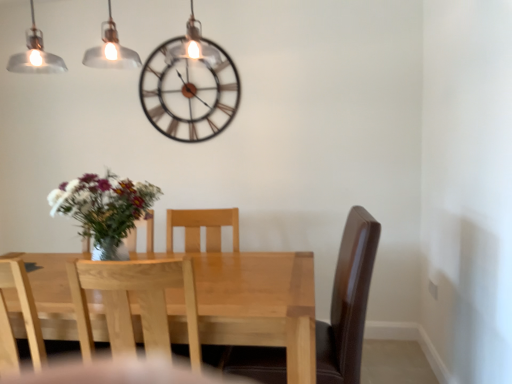
Where is `light wood chair at left, acting as the 1th chair starting from the left`? Image resolution: width=512 pixels, height=384 pixels. light wood chair at left, acting as the 1th chair starting from the left is located at coordinates (23, 318).

This screenshot has width=512, height=384. I want to click on light wood chair at center, the first chair when ordered from right to left, so click(x=139, y=303).

The height and width of the screenshot is (384, 512). What do you see at coordinates (139, 303) in the screenshot?
I see `light wood chair at center, the first chair when ordered from right to left` at bounding box center [139, 303].

The image size is (512, 384). What do you see at coordinates (256, 302) in the screenshot?
I see `light wood table at center` at bounding box center [256, 302].

In order to click on light wood chair at left, acting as the 1th chair starting from the left in this screenshot , I will do `click(23, 318)`.

Is point (38, 325) more distant than point (181, 139)?

That is True.

Is there a large distance between light wood chair at left, the 2th chair positioned from the right, and metallic brown clock at upper center?

Yes.

From the image's perspective, is light wood chair at left, the 2th chair positioned from the right, located beneath metallic brown clock at upper center?

Yes, from the image's perspective, light wood chair at left, the 2th chair positioned from the right, is beneath metallic brown clock at upper center.

Is light wood chair at left, acting as the 1th chair starting from the left, wider or thinner than metallic brown clock at upper center?

Clearly, light wood chair at left, acting as the 1th chair starting from the left, has more width compared to metallic brown clock at upper center.

From the image's perspective, which one is positioned higher, light wood chair at center, the second chair positioned from the left, or light wood table at center?

From the image's view, light wood chair at center, the second chair positioned from the left, is above.

How many degrees apart are the facing directions of light wood chair at center, the second chair positioned from the left, and light wood table at center?

light wood chair at center, the second chair positioned from the left, and light wood table at center are facing 180 degrees away from each other.

This screenshot has height=384, width=512. In order to click on kitchen & dining room table below the light wood chair at center, the first chair when ordered from right to left (from the image's perspective) in this screenshot , I will do `click(256, 302)`.

Which is in front, light wood table at center or light wood chair at left, acting as the 1th chair starting from the left?

light wood table at center is in front.

Which of these two, light wood table at center or light wood chair at left, the 2th chair positioned from the right, is bigger?

With larger size is light wood table at center.

Does light wood table at center appear on the left side of light wood chair at left, the 2th chair positioned from the right?

No.

Are light wood table at center and light wood chair at left, acting as the 1th chair starting from the left, beside each other?

No, light wood table at center is not with light wood chair at left, acting as the 1th chair starting from the left.

Is light wood table at center wider than light wood chair at center, the second chair positioned from the left?

Indeed, light wood table at center has a greater width compared to light wood chair at center, the second chair positioned from the left.

Is light wood table at center spatially inside light wood chair at center, the first chair when ordered from right to left, or outside of it?

light wood table at center is not enclosed by light wood chair at center, the first chair when ordered from right to left.

Between light wood table at center and light wood chair at center, the first chair when ordered from right to left, which one has less height?

light wood table at center is shorter.

In the scene shown: Considering the relative positions of light wood table at center and light wood chair at center, the second chair positioned from the left, in the image provided, is light wood table at center to the left of light wood chair at center, the second chair positioned from the left, from the viewer's perspective?

Indeed, light wood table at center is positioned on the left side of light wood chair at center, the second chair positioned from the left.

Who is bigger, light wood chair at center, the second chair positioned from the left, or metallic brown clock at upper center?

light wood chair at center, the second chair positioned from the left, is bigger.

Does light wood chair at center, the first chair when ordered from right to left, appear on the left side of metallic brown clock at upper center?

No.

Is light wood chair at center, the second chair positioned from the left, wider than metallic brown clock at upper center?

Correct, the width of light wood chair at center, the second chair positioned from the left, exceeds that of metallic brown clock at upper center.

Based on the photo, from the image's perspective, which is above, light wood chair at center, the first chair when ordered from right to left, or metallic brown clock at upper center?

From the image's view, metallic brown clock at upper center is above.

Looking at this image, from the image's perspective, is metallic brown clock at upper center above or below light wood chair at center, the second chair positioned from the left?

metallic brown clock at upper center is situated higher than light wood chair at center, the second chair positioned from the left, in the image.

There is a metallic brown clock at upper center. Identify the location of the 2nd chair below it (from the image's perspective). This screenshot has width=512, height=384. (139, 303).

Consider the image. From the image's perspective, who appears lower, metallic brown clock at upper center or light wood chair at left, the 2th chair positioned from the right?

light wood chair at left, the 2th chair positioned from the right.

At what (x,y) coordinates should I click in order to perform the action: click on the 1st chair in front of the metallic brown clock at upper center, starting your count from the anchor. Please return your answer as a coordinate pair (x, y). The height and width of the screenshot is (384, 512). Looking at the image, I should click on (23, 318).

This screenshot has height=384, width=512. I want to click on wall clock behind the light wood chair at left, the 2th chair positioned from the right, so click(x=189, y=91).

In order to click on kitchen & dining room table on the left of light wood chair at center, the first chair when ordered from right to left in this screenshot , I will do `click(256, 302)`.

From the image, which object appears to be farther from light wood chair at center, the first chair when ordered from right to left, light wood chair at left, the 2th chair positioned from the right, or light wood table at center?

light wood chair at left, the 2th chair positioned from the right, is further to light wood chair at center, the first chair when ordered from right to left.

When comparing their distances from light wood table at center, does metallic brown clock at upper center or light wood chair at left, the 2th chair positioned from the right, seem closer?

Based on the image, metallic brown clock at upper center appears to be nearer to light wood table at center.

From the image, which object appears to be farther from light wood chair at center, the first chair when ordered from right to left, metallic brown clock at upper center or light wood chair at left, acting as the 1th chair starting from the left?

Based on the image, metallic brown clock at upper center appears to be further to light wood chair at center, the first chair when ordered from right to left.

When comparing their distances from metallic brown clock at upper center, does light wood chair at left, the 2th chair positioned from the right, or light wood chair at center, the second chair positioned from the left, seem further?

light wood chair at left, the 2th chair positioned from the right, lies further to metallic brown clock at upper center than the other object.

When comparing their distances from light wood table at center, does light wood chair at left, acting as the 1th chair starting from the left, or light wood chair at center, the second chair positioned from the left, seem further?

light wood chair at left, acting as the 1th chair starting from the left.

Looking at the image, which one is located further to light wood chair at center, the second chair positioned from the left, light wood chair at left, acting as the 1th chair starting from the left, or metallic brown clock at upper center?

The object further to light wood chair at center, the second chair positioned from the left, is metallic brown clock at upper center.

Estimate the real-world distances between objects in this image. Which object is closer to light wood chair at left, the 2th chair positioned from the right, light wood table at center or light wood chair at center, the second chair positioned from the left?

light wood chair at center, the second chair positioned from the left, is closer to light wood chair at left, the 2th chair positioned from the right.

Considering their positions, is light wood chair at center, the second chair positioned from the left, positioned closer to metallic brown clock at upper center than light wood chair at left, acting as the 1th chair starting from the left?

The object closer to metallic brown clock at upper center is light wood chair at center, the second chair positioned from the left.

At what (x,y) coordinates should I click in order to perform the action: click on kitchen & dining room table between light wood chair at left, the 2th chair positioned from the right, and light wood chair at center, the first chair when ordered from right to left. Please return your answer as a coordinate pair (x, y). Looking at the image, I should click on (256, 302).

Find the location of a particular element. chair between light wood chair at center, the second chair positioned from the left, and metallic brown clock at upper center from front to back is located at coordinates (23, 318).